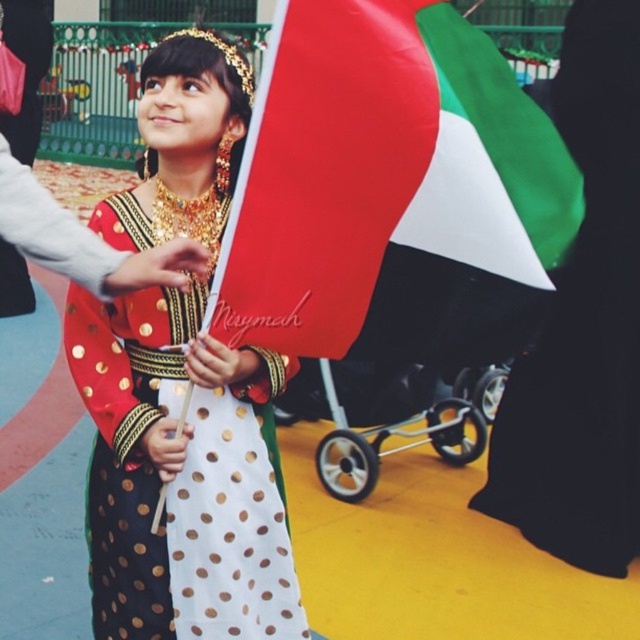
Question: Estimate the real-world distances between objects in this image. Which object is closer to the polyester flag at center?

Choices:
 (A) polka dot dress at center
 (B) green fabric flag at right

Answer: (A)

Question: Does polyester flag at center appear over green fabric flag at right?

Choices:
 (A) yes
 (B) no

Answer: (A)

Question: Does polyester flag at center lie in front of green fabric flag at right?

Choices:
 (A) yes
 (B) no

Answer: (A)

Question: Which point appears closest to the camera in this image?

Choices:
 (A) (202, 484)
 (B) (618, 465)

Answer: (A)

Question: Based on their relative distances, which object is farther from the green fabric flag at right?

Choices:
 (A) polyester flag at center
 (B) polka dot dress at center

Answer: (A)

Question: Is the position of polka dot dress at center more distant than that of green fabric flag at right?

Choices:
 (A) yes
 (B) no

Answer: (B)